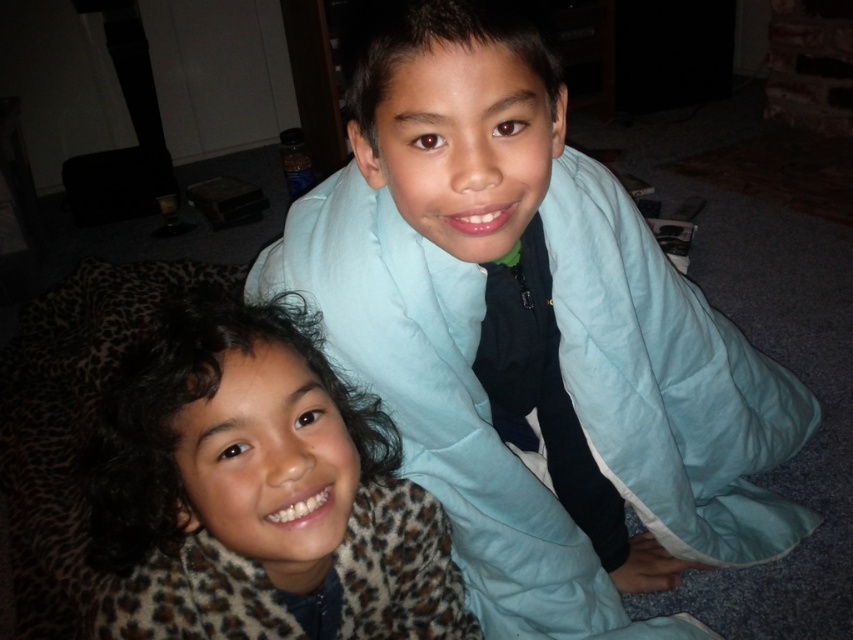
Which is below, light blue quilted blanket at upper center or leopard print sweater at lower left?

Positioned lower is leopard print sweater at lower left.

Between light blue quilted blanket at upper center and leopard print sweater at lower left, which one appears on the left side from the viewer's perspective?

From the viewer's perspective, leopard print sweater at lower left appears more on the left side.

Identify the location of light blue quilted blanket at upper center. Image resolution: width=853 pixels, height=640 pixels. (531, 332).

Locate an element on the screen. This screenshot has height=640, width=853. light blue quilted blanket at upper center is located at coordinates (531, 332).